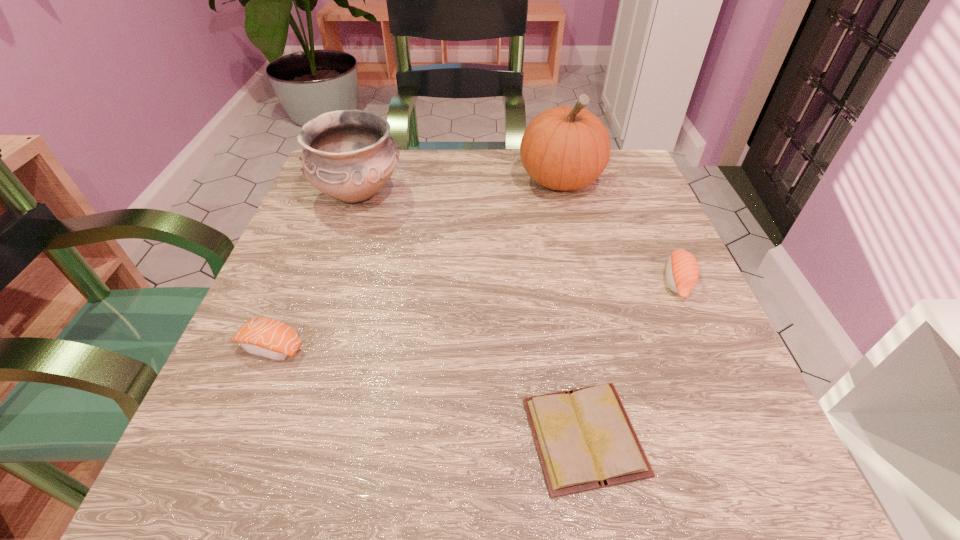
Locate an element on the screen. This screenshot has width=960, height=540. the tallest object is located at coordinates (564, 148).

Image resolution: width=960 pixels, height=540 pixels. I want to click on pottery, so click(x=348, y=155).

The width and height of the screenshot is (960, 540). What are the coordinates of `the taller sushi` in the screenshot? It's located at (682, 272).

The image size is (960, 540). What are the coordinates of `the rightmost object` in the screenshot? It's located at (682, 272).

Find the location of a particular element. the shorter sushi is located at coordinates (269, 338).

Locate an element on the screen. the fourth farthest object is located at coordinates tap(269, 338).

You are a GUI agent. You are given a task and a screenshot of the screen. Output one action in this format:
    pyautogui.click(x=<x>, y=<y>)
    Task: Click on the diary
    This screenshot has height=540, width=960.
    Given the screenshot: What is the action you would take?
    pyautogui.click(x=584, y=438)

Where is `the shortest object`? the shortest object is located at coordinates (584, 438).

At what (x,y) coordinates should I click in order to perform the action: click on vacant space located 0.080m on the stem of the tallest object. Please return your answer as a coordinate pair (x, y). The width and height of the screenshot is (960, 540). Looking at the image, I should click on (571, 228).

Find the location of a particular element. This screenshot has width=960, height=540. vacant space located 0.330m on the front of the pottery is located at coordinates (304, 353).